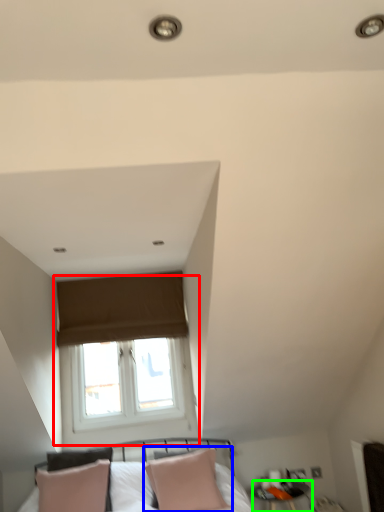
Question: Estimate the real-world distances between objects in this image. Which object is closer to window (highlighted by a red box), pillow (highlighted by a blue box) or side table (highlighted by a green box)?

Choices:
 (A) pillow
 (B) side table

Answer: (A)